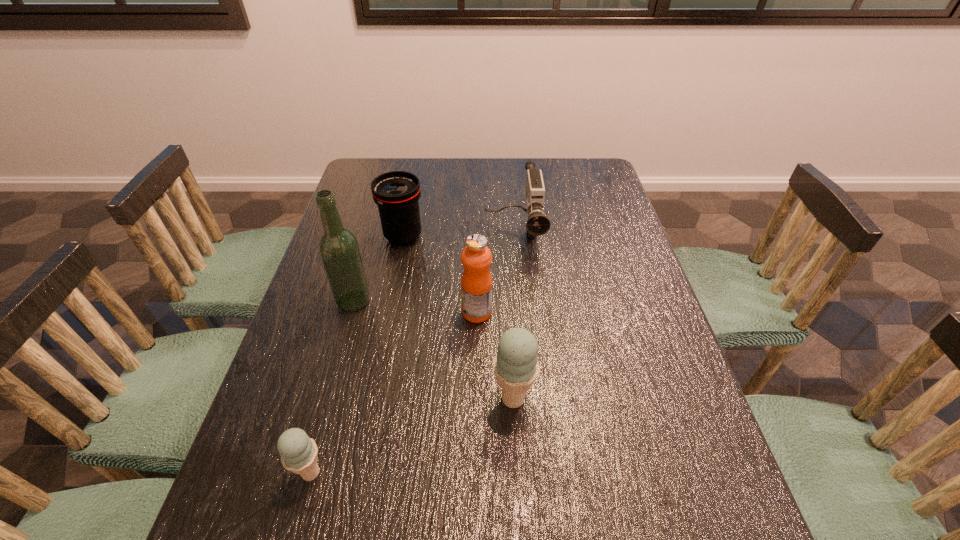
Locate an element on the screen. The image size is (960, 540). free space located 0.190m on the recording direction of the camcorder is located at coordinates (520, 311).

You are a GUI agent. You are given a task and a screenshot of the screen. Output one action in this format:
    pyautogui.click(x=<x>, y=<y>)
    Task: Click on the vacant space located 0.390m on the front of the liquor
    This screenshot has height=540, width=960.
    Given the screenshot: What is the action you would take?
    click(306, 471)

Identify the location of blank space located 0.170m on the right of the telephoto lens. The width and height of the screenshot is (960, 540). (482, 237).

The height and width of the screenshot is (540, 960). Identify the location of blank space located 0.050m on the front of the fruit juice. tap(477, 340).

Where is `object situated at the near edge`? This screenshot has width=960, height=540. object situated at the near edge is located at coordinates (299, 453).

Locate an element on the screen. ice cream that is at the left edge is located at coordinates (299, 453).

I want to click on liquor located at the left edge, so click(x=338, y=247).

Locate an element on the screen. Image resolution: width=960 pixels, height=540 pixels. telephoto lens situated at the left edge is located at coordinates (396, 193).

Identify the location of object located at the near left corner. This screenshot has height=540, width=960. (299, 453).

I want to click on free spot at the far edge of the desktop, so click(x=541, y=163).